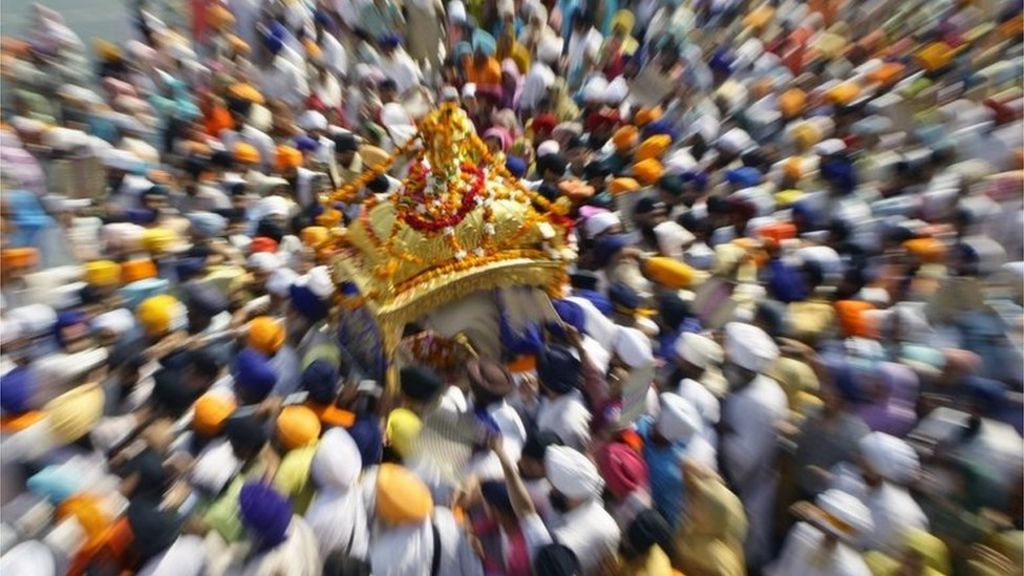
I want to click on golden garlands, so click(x=361, y=179), click(x=393, y=234), click(x=512, y=181).